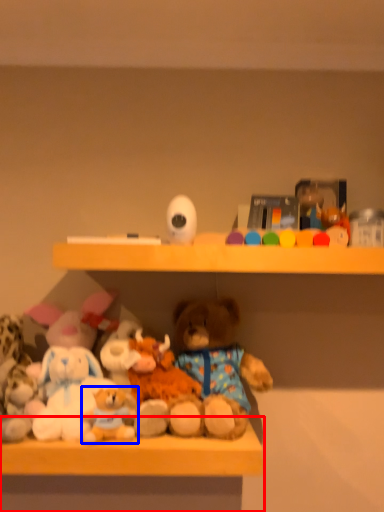
Question: Which object is further to the camera taking this photo, table (highlighted by a red box) or toy (highlighted by a blue box)?

Choices:
 (A) table
 (B) toy

Answer: (B)